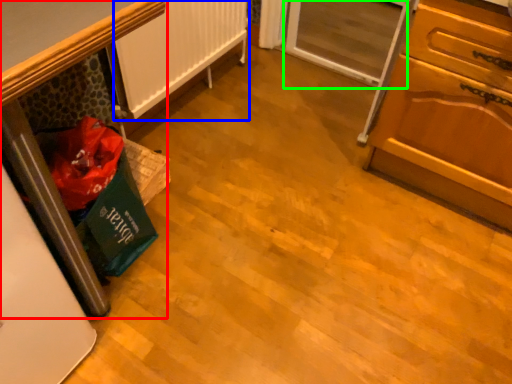
Question: Which is farther away from furniture (highlighted by a red box)? radiator (highlighted by a blue box) or screen door (highlighted by a green box)?

Choices:
 (A) radiator
 (B) screen door

Answer: (B)